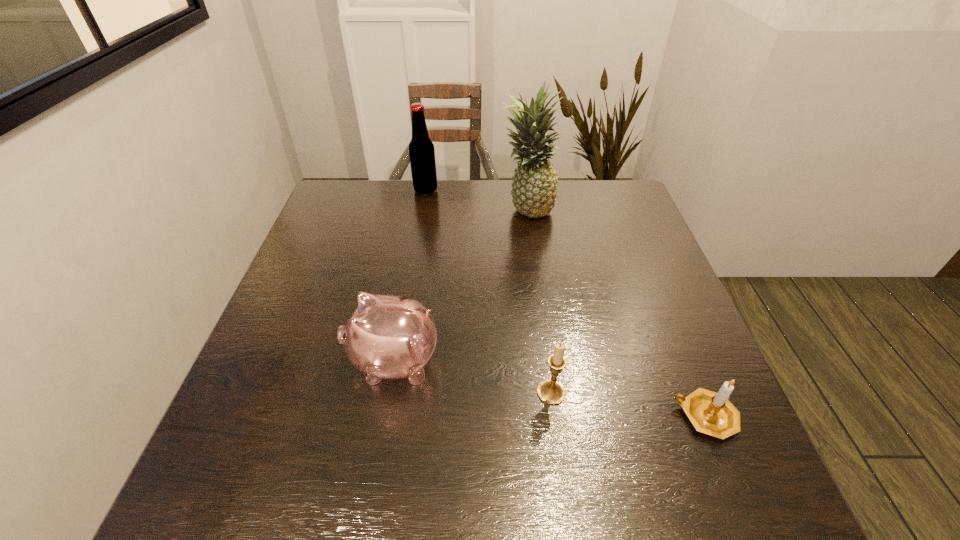
The height and width of the screenshot is (540, 960). Identify the location of free area in between the piggy bank and the pineapple. (461, 286).

Locate an element on the screen. Image resolution: width=960 pixels, height=540 pixels. free space between the beer bottle and the pineapple is located at coordinates (476, 200).

Where is `object that is the fourth closest to the left candle holder`? This screenshot has height=540, width=960. object that is the fourth closest to the left candle holder is located at coordinates (421, 149).

Select which object appears as the third closest to the beer bottle. Please provide its 2D coordinates. Your answer should be formatted as a tuple, i.e. [(x, y)], where the tuple contains the x and y coordinates of a point satisfying the conditions above.

[(550, 391)]

In order to click on vacant space that satisfies the following two spatial constraints: 1. on the front facing side of the piggy bank; 2. on the back side of the left candle holder in this screenshot , I will do [388, 392].

Find the location of a particular element. free space that satisfies the following two spatial constraints: 1. on the back side of the shorter candle holder; 2. on the front facing side of the piggy bank is located at coordinates (684, 362).

You are a GUI agent. You are given a task and a screenshot of the screen. Output one action in this format:
    pyautogui.click(x=<x>, y=<y>)
    Task: Click on the vacant point that satisfies the following two spatial constraints: 1. on the front facing side of the piggy bank; 2. on the back side of the left candle holder
    Image resolution: width=960 pixels, height=540 pixels.
    Given the screenshot: What is the action you would take?
    pyautogui.click(x=388, y=392)

This screenshot has height=540, width=960. Identify the location of vacant area in the image that satisfies the following two spatial constraints: 1. on the back side of the left candle holder; 2. on the right side of the pineapple. (527, 211).